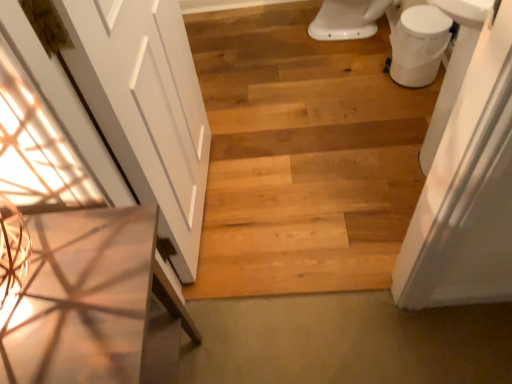
Locate an element on the screen. This screenshot has width=512, height=384. vacant area situated to the left side of natural wood plank at center is located at coordinates (241, 276).